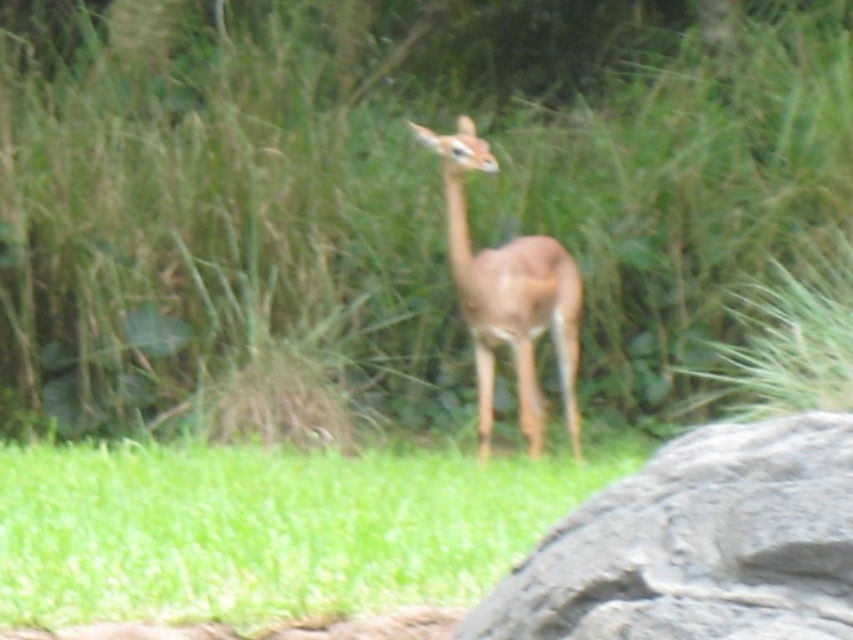
Question: Which of the following is the farthest from the observer?

Choices:
 (A) green grass at center
 (B) green grassy at center
 (C) gray rough rock at center
 (D) brown matte antelope at center

Answer: (B)

Question: Can you confirm if gray rough rock at center is thinner than brown matte antelope at center?

Choices:
 (A) no
 (B) yes

Answer: (B)

Question: Among these points, which one is farthest from the camera?

Choices:
 (A) (726, 499)
 (B) (270, 548)

Answer: (B)

Question: Can you confirm if green grass at center is positioned above brown matte antelope at center?

Choices:
 (A) yes
 (B) no

Answer: (B)

Question: Is green grassy at center further to camera compared to green grass at center?

Choices:
 (A) no
 (B) yes

Answer: (B)

Question: Which of the following is the closest to the observer?

Choices:
 (A) brown matte antelope at center
 (B) green grassy at center

Answer: (A)